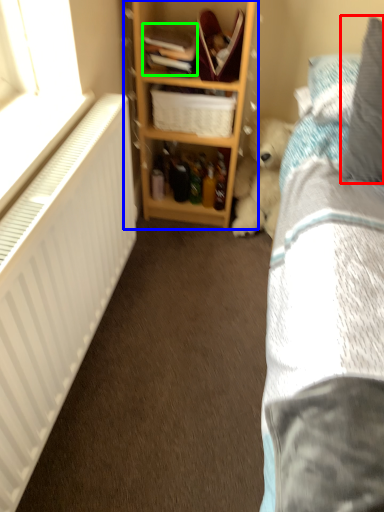
Question: Estimate the real-world distances between objects in this image. Which object is farther from pillow (highlighted by a red box), shelf (highlighted by a blue box) or book (highlighted by a green box)?

Choices:
 (A) shelf
 (B) book

Answer: (B)